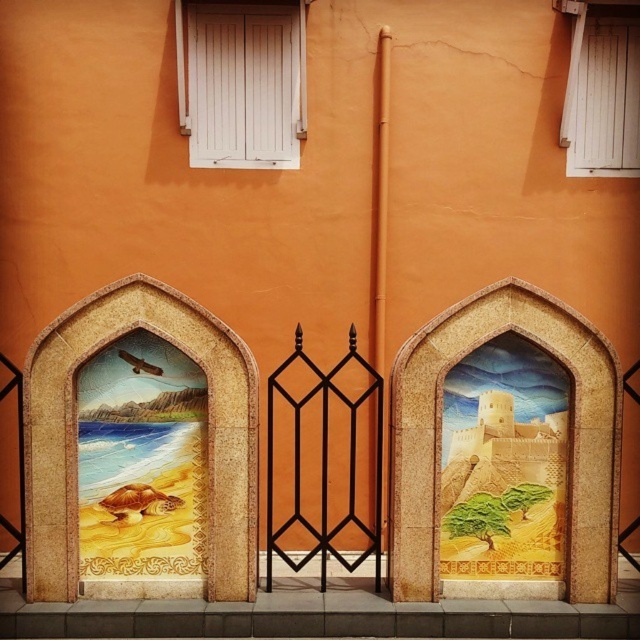
Which is more to the right, white painted wood at upper center or white wood window at upper right?

From the viewer's perspective, white wood window at upper right appears more on the right side.

Between white painted wood at upper center and white wood window at upper right, which one is positioned lower?

white painted wood at upper center is lower down.

What do you see at coordinates (241, 83) in the screenshot? The height and width of the screenshot is (640, 640). I see `white painted wood at upper center` at bounding box center [241, 83].

Identify the location of white painted wood at upper center. This screenshot has height=640, width=640. (241, 83).

Does white painted wood at upper center have a greater height compared to black wrought iron gate at center?

No, white painted wood at upper center is not taller than black wrought iron gate at center.

Between white painted wood at upper center and black wrought iron gate at center, which one appears on the left side from the viewer's perspective?

white painted wood at upper center

Measure the distance between white painted wood at upper center and camera.

They are 7.12 meters apart.

Locate an element on the screen. This screenshot has width=640, height=640. white painted wood at upper center is located at coordinates (241, 83).

Can you confirm if golden sandcastle at right is thinner than white wood window at upper right?

Incorrect, golden sandcastle at right's width is not less than white wood window at upper right's.

Is point (538, 522) farther from viewer compared to point (596, 108)?

No, (538, 522) is closer to viewer.

You are a GUI agent. You are given a task and a screenshot of the screen. Output one action in this format:
    pyautogui.click(x=<x>, y=<y>)
    Task: Click on the golden sandcastle at right
    The width and height of the screenshot is (640, 640).
    Given the screenshot: What is the action you would take?
    pyautogui.click(x=502, y=493)